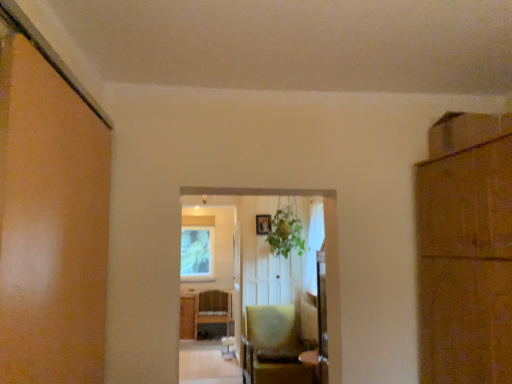
Question: Is matte yellow chair at center bigger than brown cardboard cabinet at right?

Choices:
 (A) yes
 (B) no

Answer: (A)

Question: From the image's perspective, is matte yellow chair at center on top of brown cardboard cabinet at right?

Choices:
 (A) no
 (B) yes

Answer: (A)

Question: Can you see matte yellow chair at center touching brown cardboard cabinet at right?

Choices:
 (A) yes
 (B) no

Answer: (B)

Question: Would you say matte yellow chair at center is outside brown cardboard cabinet at right?

Choices:
 (A) yes
 (B) no

Answer: (A)

Question: Can you confirm if matte yellow chair at center is thinner than brown cardboard cabinet at right?

Choices:
 (A) yes
 (B) no

Answer: (B)

Question: From a real-world perspective, is wooden picture frame at center physically located above or below white matte window screen at upper center?

Choices:
 (A) below
 (B) above

Answer: (B)

Question: Is wooden picture frame at center bigger or smaller than white matte window screen at upper center?

Choices:
 (A) big
 (B) small

Answer: (B)

Question: Considering the positions of point (269, 228) and point (202, 241), is point (269, 228) closer or farther from the camera than point (202, 241)?

Choices:
 (A) farther
 (B) closer

Answer: (B)

Question: In the image, is wooden picture frame at center positioned in front of or behind white matte window screen at upper center?

Choices:
 (A) behind
 (B) front

Answer: (B)

Question: In terms of size, does matte yellow chair at center appear bigger or smaller than white matte window screen at upper center?

Choices:
 (A) small
 (B) big

Answer: (B)

Question: Is matte yellow chair at center in front of or behind white matte window screen at upper center in the image?

Choices:
 (A) front
 (B) behind

Answer: (A)

Question: From a real-world perspective, is matte yellow chair at center physically located above or below white matte window screen at upper center?

Choices:
 (A) above
 (B) below

Answer: (B)

Question: Is point [x=284, y=324] closer or farther from the camera than point [x=198, y=243]?

Choices:
 (A) farther
 (B) closer

Answer: (B)

Question: Looking at the image, does matte yellow chair at center seem bigger or smaller compared to wooden cabinet at center?

Choices:
 (A) big
 (B) small

Answer: (A)

Question: Is matte yellow chair at center to the left or to the right of wooden cabinet at center in the image?

Choices:
 (A) left
 (B) right

Answer: (B)